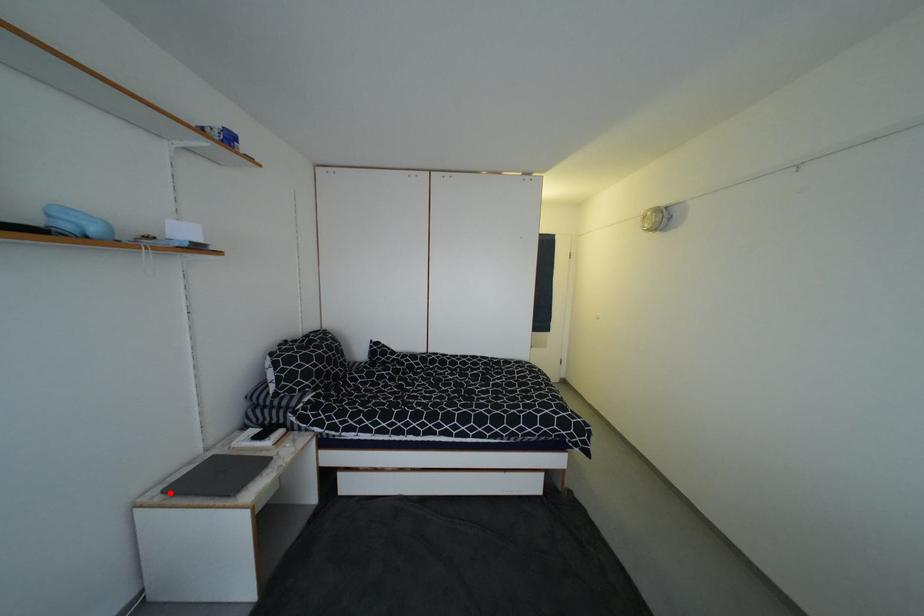
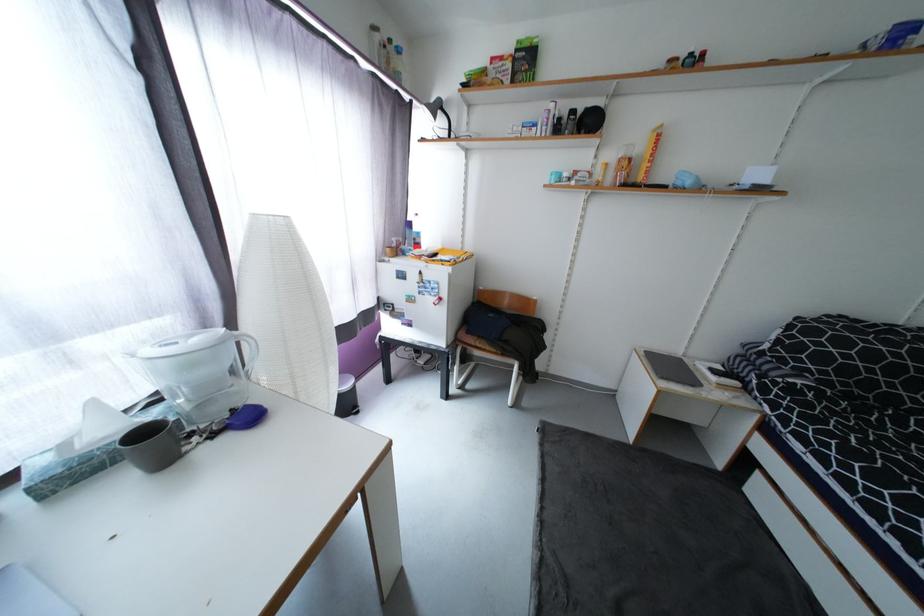
Locate, in the second image, the point that corresponds to the highlighted location in the first image.

(650, 353)